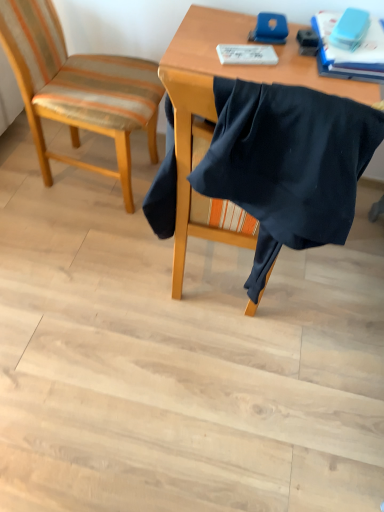
Locate an element on the screen. The image size is (384, 512). free point to the left of white paper at upper center is located at coordinates [206, 49].